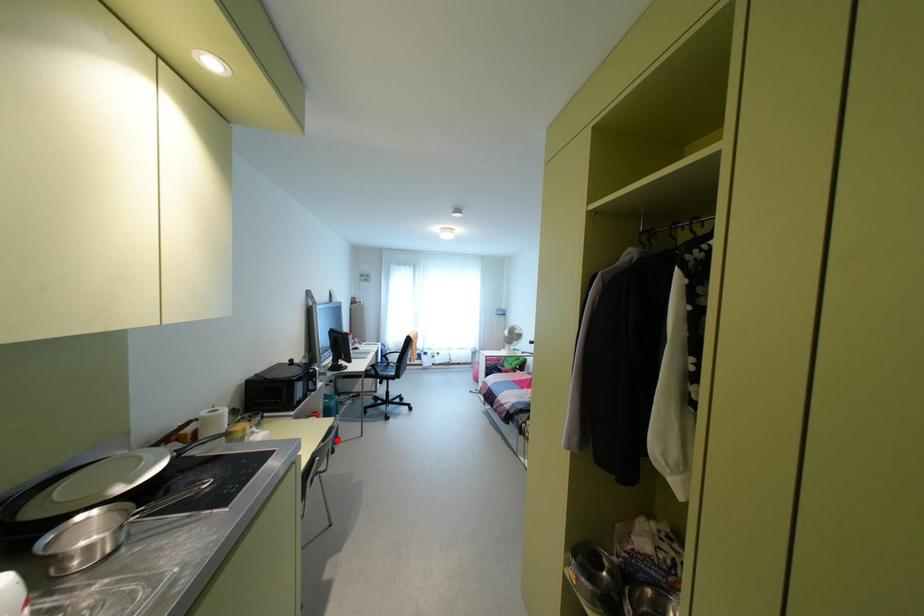
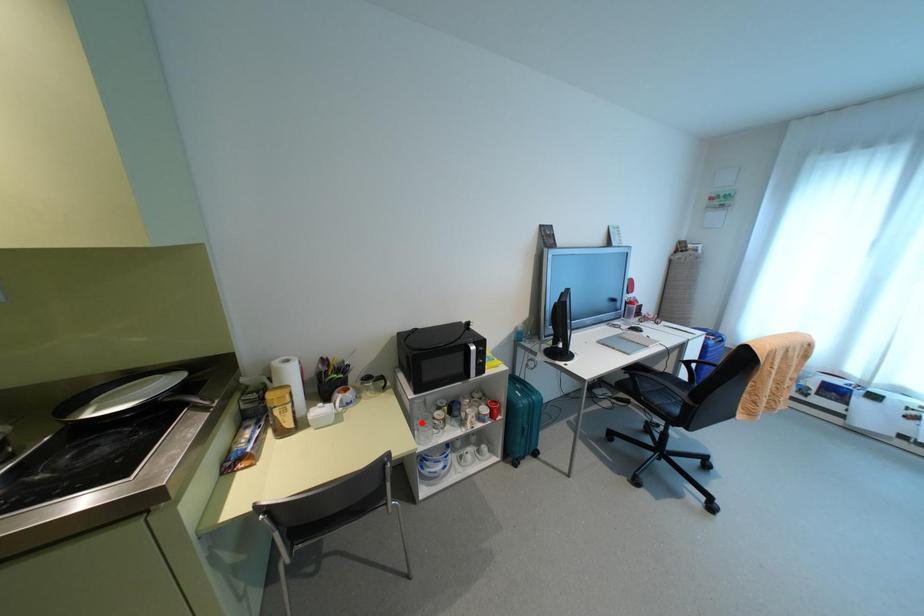
I am providing you with two images of the same scene from different viewpoints. A red point is marked on the first image and another point is marked on the second image. Does the point marked in image1 correspond to the same location as the one in image2?

No